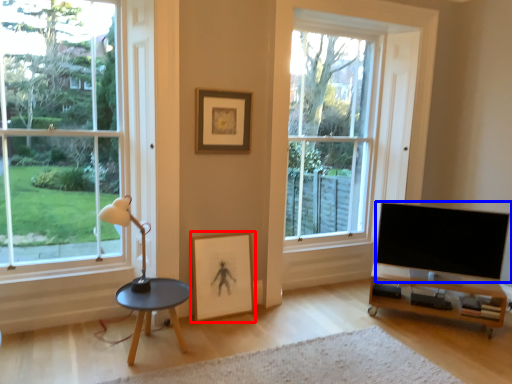
Question: Which point is closer to the camera, picture frame (highlighted by a red box) or television (highlighted by a blue box)?

Choices:
 (A) picture frame
 (B) television

Answer: (B)